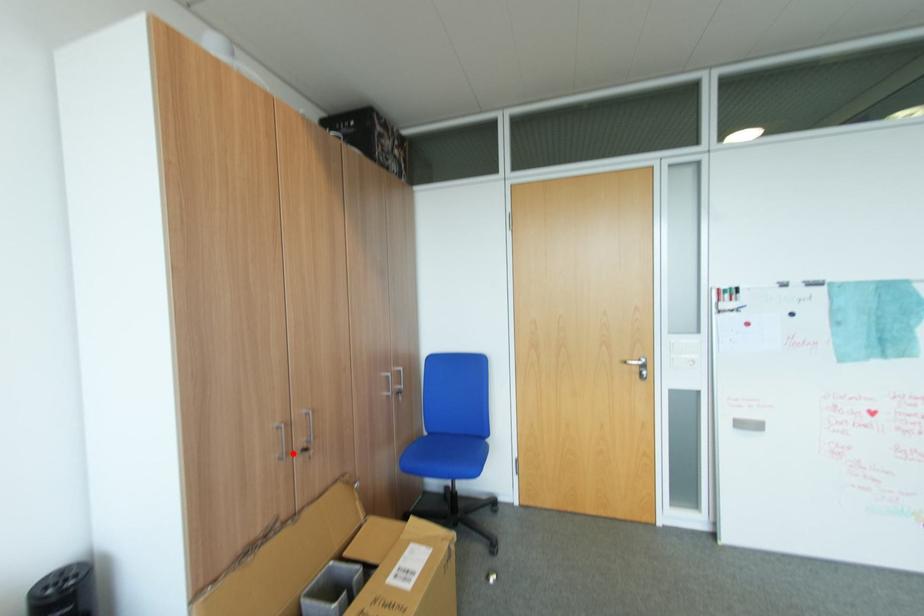
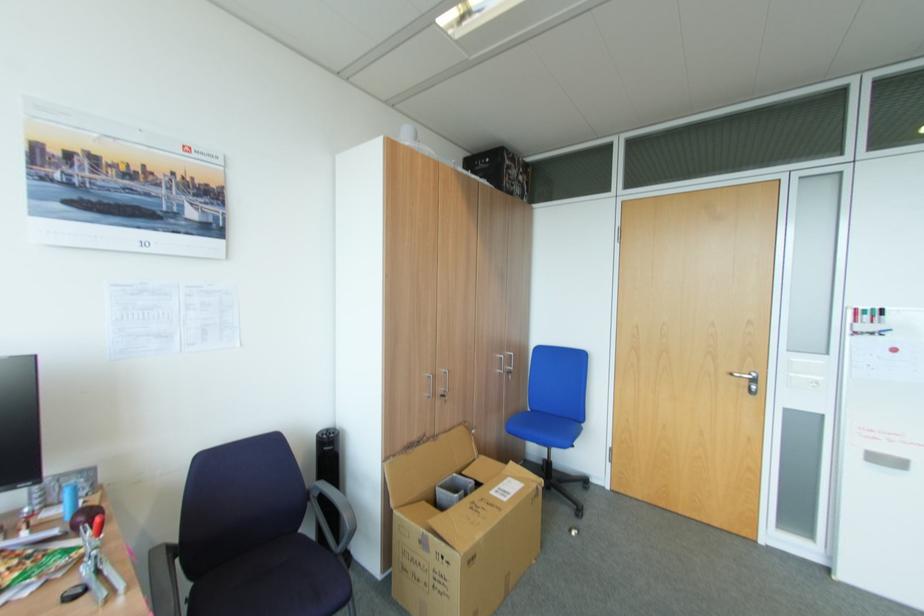
Where in the second image is the point corresponding to the highlighted location from the first image?

(440, 394)